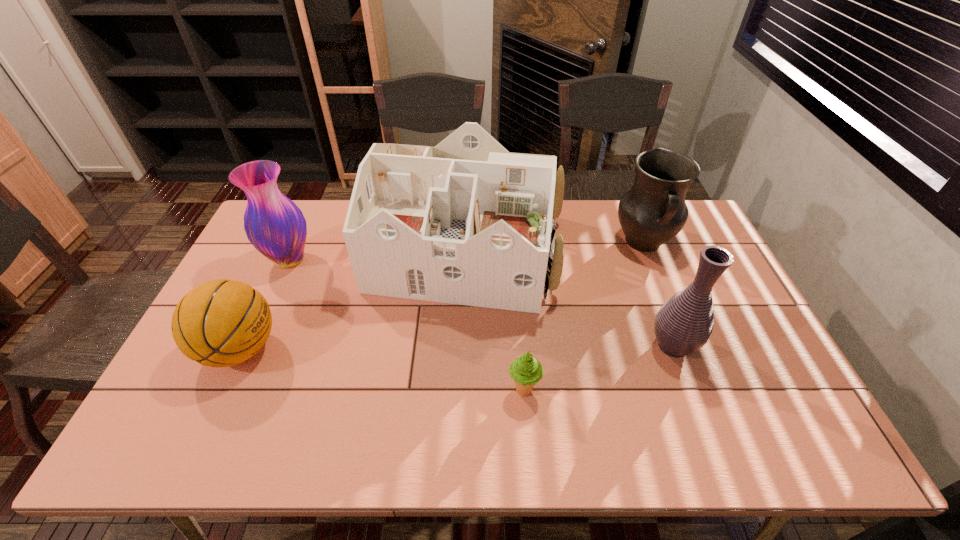
Identify the location of vacant area located on the surface of the basketball near the brand logo. (310, 349).

You are a GUI agent. You are given a task and a screenshot of the screen. Output one action in this format:
    pyautogui.click(x=<x>, y=<y>)
    Task: Click on the vacant space located on the back of the shortest object
    The width and height of the screenshot is (960, 540).
    Given the screenshot: What is the action you would take?
    pyautogui.click(x=521, y=361)

Where is `dollhouse located in the far edge section of the desktop`? Image resolution: width=960 pixels, height=540 pixels. dollhouse located in the far edge section of the desktop is located at coordinates (466, 222).

This screenshot has width=960, height=540. I want to click on pitcher that is at the far edge, so click(x=653, y=211).

You are a GUI agent. You are given a task and a screenshot of the screen. Output one action in this format:
    pyautogui.click(x=<x>, y=<y>)
    Task: Click on the vase that is at the left edge
    Image resolution: width=960 pixels, height=540 pixels.
    Given the screenshot: What is the action you would take?
    pyautogui.click(x=275, y=226)

Where is `basketball that is at the left edge`? Image resolution: width=960 pixels, height=540 pixels. basketball that is at the left edge is located at coordinates (221, 323).

This screenshot has width=960, height=540. In order to click on object that is positioned at the right edge in this screenshot , I will do `click(653, 211)`.

Image resolution: width=960 pixels, height=540 pixels. Find the location of `object at the far right corner`. object at the far right corner is located at coordinates (653, 211).

Identify the location of free space at the far edge of the desktop. Image resolution: width=960 pixels, height=540 pixels. click(x=608, y=225).

In the image, there is a desktop. Find the location of `vacant space at the near edge`. vacant space at the near edge is located at coordinates (534, 447).